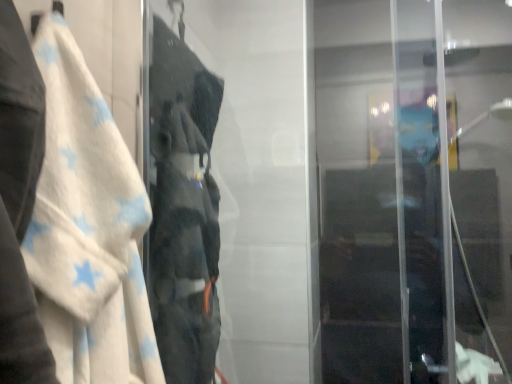
This screenshot has width=512, height=384. What do you see at coordinates (88, 228) in the screenshot? I see `white soft towel at left` at bounding box center [88, 228].

Find the location of a particular element. This screenshot has width=512, height=384. white soft towel at left is located at coordinates (88, 228).

Measure the distance between white soft towel at left and camera.

white soft towel at left and camera are 16.69 inches apart from each other.

You are a GUI agent. You are given a task and a screenshot of the screen. Output one action in this format:
    pyautogui.click(x=<x>, y=<y>)
    Task: Click on the white soft towel at left
    The width and height of the screenshot is (512, 384).
    Given the screenshot: What is the action you would take?
    pyautogui.click(x=88, y=228)